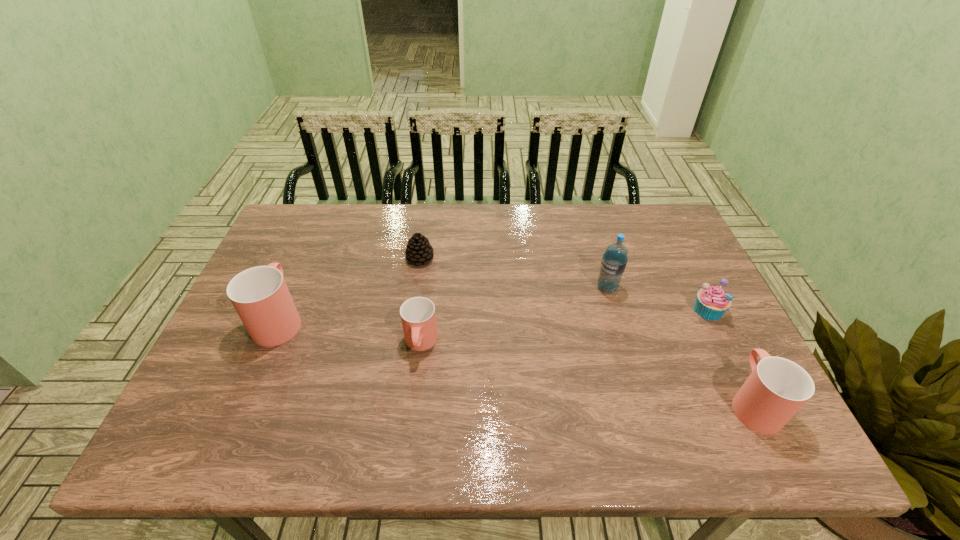
Please determine a free point for an extra cup to ensure balance. Please provide its 2D coordinates. Your answer should be formatted as a tuple, i.e. [(x, y)], where the tuple contains the x and y coordinates of a point satisfying the conditions above.

[(577, 372)]